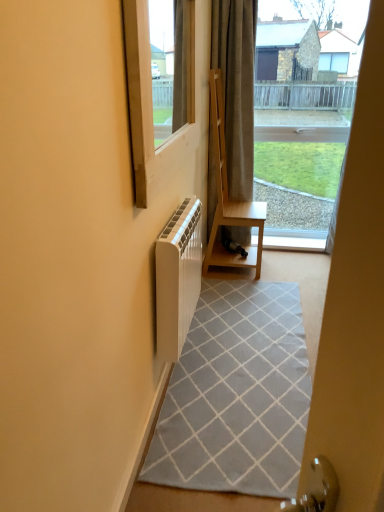
What are the coordinates of `free space above gray woven rug at center (from a real-world perspective)` in the screenshot? It's located at (236, 355).